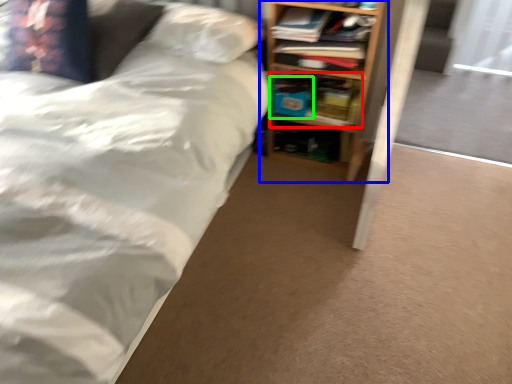
Question: Considering the real-world distances, which object is farthest from book (highlighted by a red box)? shelf (highlighted by a blue box) or paperback book (highlighted by a green box)?

Choices:
 (A) shelf
 (B) paperback book

Answer: (A)